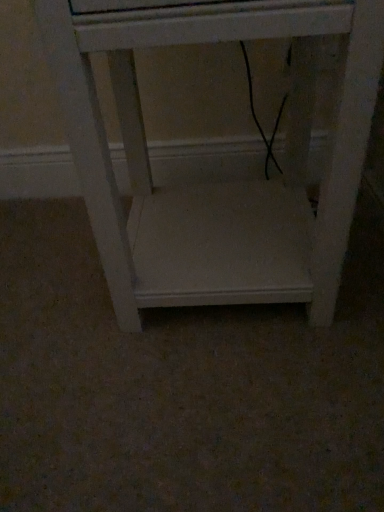
This screenshot has height=512, width=384. I want to click on vacant space in front of white matte shelf at center, so click(x=217, y=407).